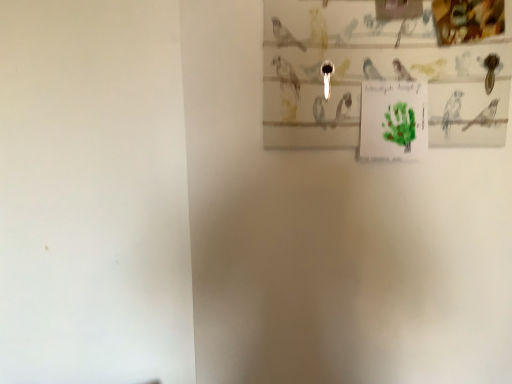
Question: From the image's perspective, is green paper at upper center above or below matte paper picture frame at upper right?

Choices:
 (A) above
 (B) below

Answer: (B)

Question: Looking at their shapes, would you say green paper at upper center is wider or thinner than matte paper picture frame at upper right?

Choices:
 (A) thin
 (B) wide

Answer: (B)

Question: Is point (388, 135) positioned closer to the camera than point (295, 132)?

Choices:
 (A) farther
 (B) closer

Answer: (B)

Question: Is point (303, 81) closer or farther from the camera than point (425, 137)?

Choices:
 (A) farther
 (B) closer

Answer: (B)

Question: From a real-world perspective, is matte paper picture frame at upper right above or below green paper at upper center?

Choices:
 (A) above
 (B) below

Answer: (A)

Question: From the image's perspective, relative to green paper at upper center, is matte paper picture frame at upper right above or below?

Choices:
 (A) above
 (B) below

Answer: (A)

Question: Considering the positions of matte paper picture frame at upper right and green paper at upper center in the image, is matte paper picture frame at upper right wider or thinner than green paper at upper center?

Choices:
 (A) wide
 (B) thin

Answer: (B)